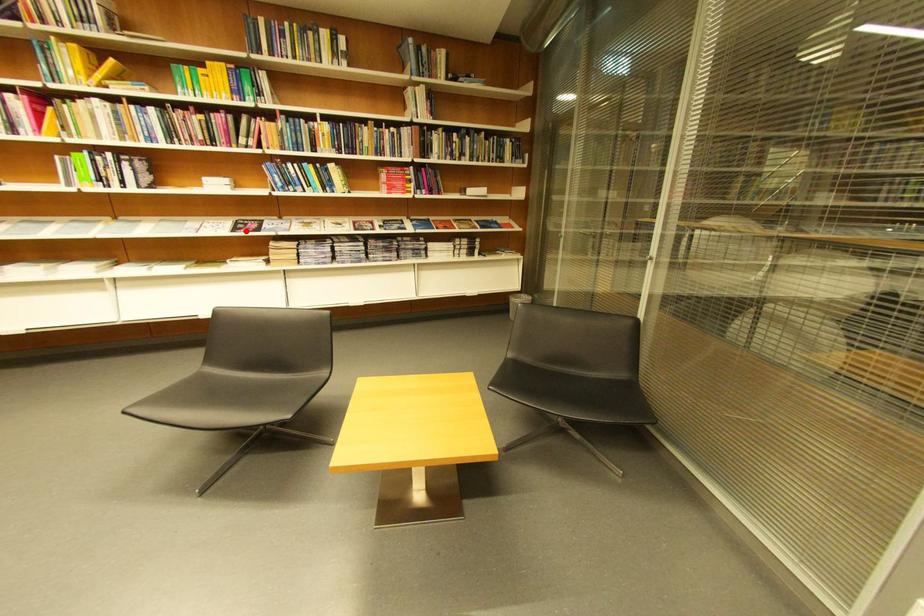
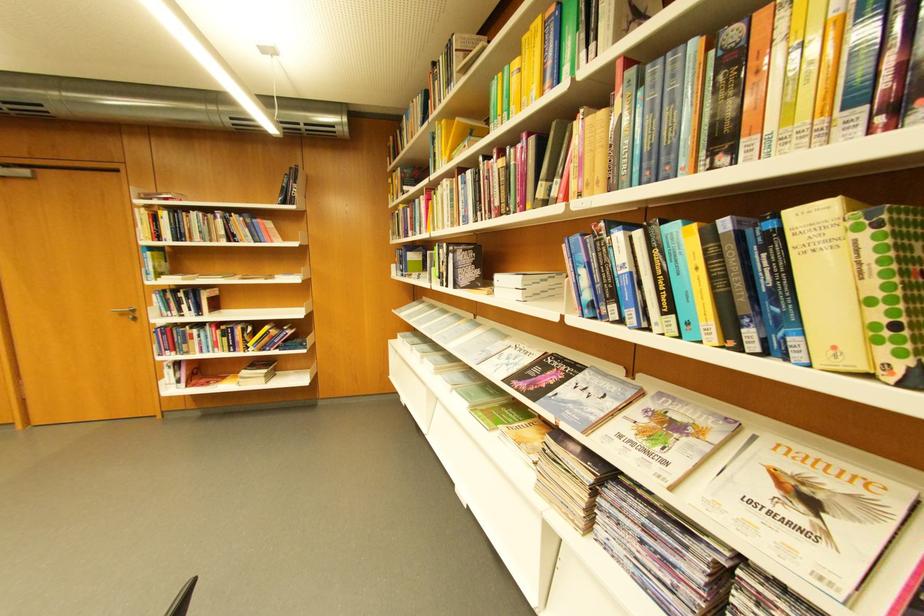
The point at the highlighted location is marked in the first image. Where is the corresponding point in the second image?

(532, 377)